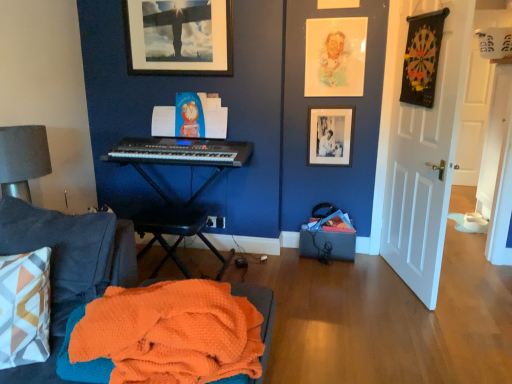
Find the location of a particular element. The width and height of the screenshot is (512, 384). vacant area to the right of black plastic keyboard at center is located at coordinates (280, 274).